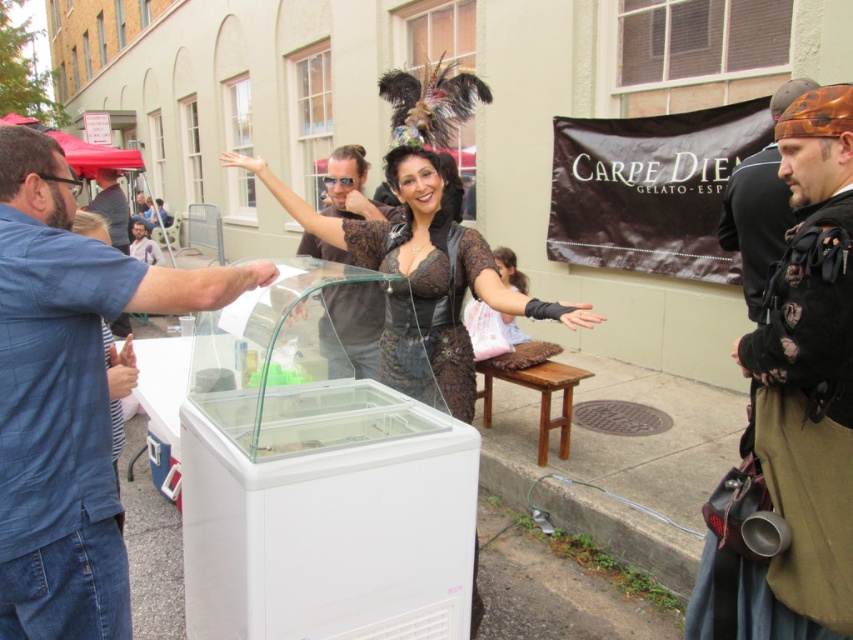
Does point (839, 218) come farther from viewer compared to point (351, 198)?

No, it is in front of (351, 198).

Does brown leather vest at center-right come behind matte black shirt at center?

No, brown leather vest at center-right is closer to the viewer.

Image resolution: width=853 pixels, height=640 pixels. What do you see at coordinates (796, 444) in the screenshot?
I see `brown leather vest at center-right` at bounding box center [796, 444].

Identify the location of brown leather vest at center-right. (796, 444).

Can you confirm if lace fabric dress at center is positioned above lace fabric corset at center?

Correct, lace fabric dress at center is located above lace fabric corset at center.

The height and width of the screenshot is (640, 853). In order to click on lace fabric dress at center in this screenshot , I will do `click(422, 276)`.

Is point (460, 305) closer to camera compared to point (448, 333)?

No, (460, 305) is further to viewer.

Where is `lace fabric dress at center`? lace fabric dress at center is located at coordinates (422, 276).

Can you confirm if blue denim shirt at left is shorter than brown leather vest at center-right?

Yes, blue denim shirt at left is shorter than brown leather vest at center-right.

Which is behind, point (42, 541) or point (740, 628)?

Positioned behind is point (740, 628).

Identify the location of blue denim shirt at left. (67, 396).